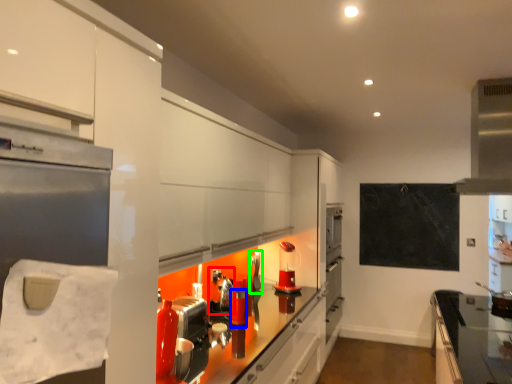
Question: Which object is positioned closest to appliance (highlighted by a red box)? Select from appliance (highlighted by a blue box) and appliance (highlighted by a green box).

Choices:
 (A) appliance
 (B) appliance

Answer: (A)